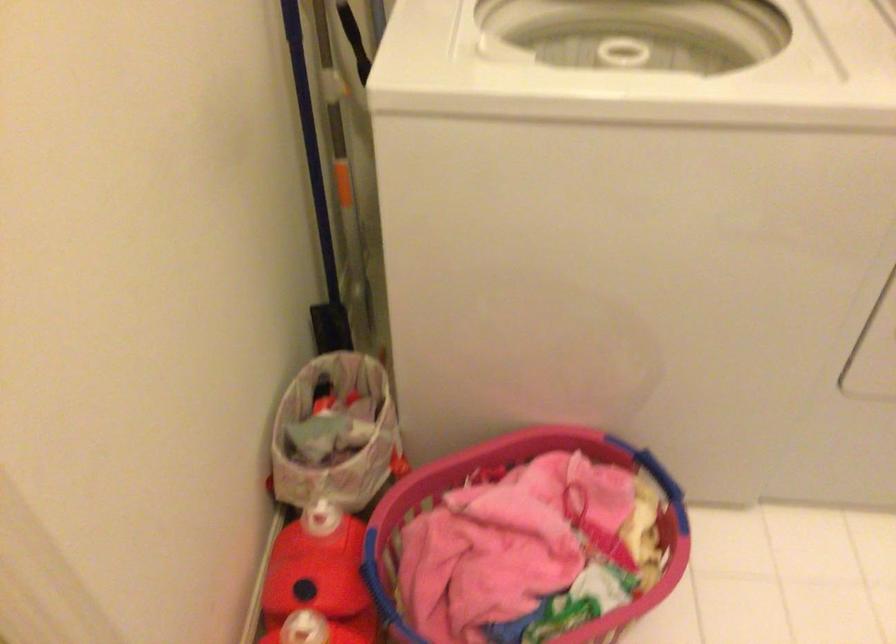
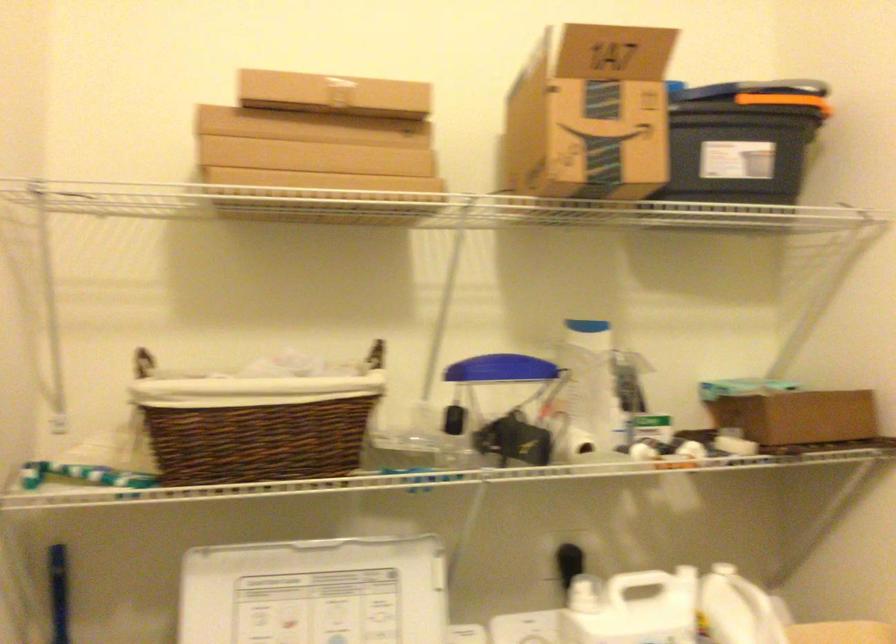
The images are taken continuously from a first-person perspective. In which direction is your viewpoint rotating?

The rotation direction of the camera is right-up.